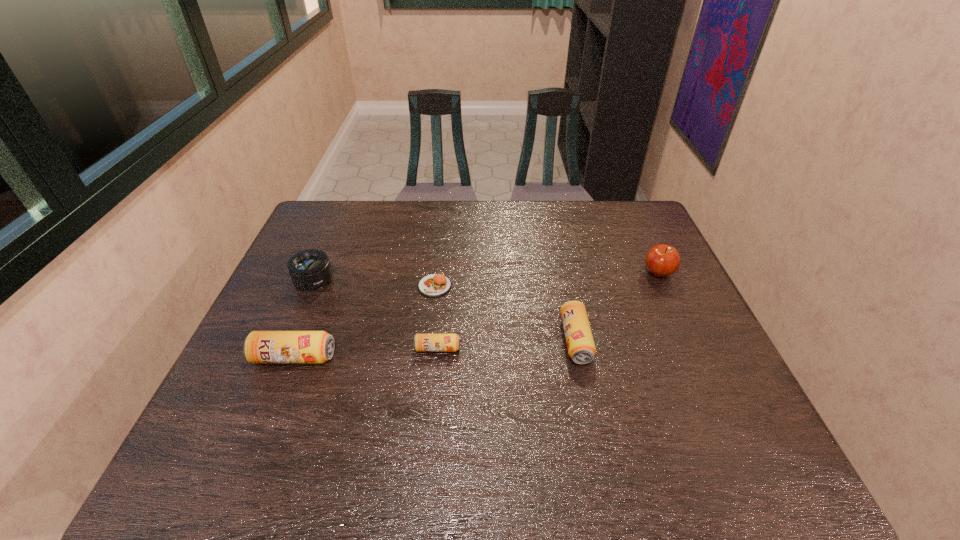
Please point a spot on the right to add another beer can. Please provide its 2D coordinates. Your answer should be formatted as a tuple, i.e. [(x, y)], where the tuple contains the x and y coordinates of a point satisfying the conditions above.

[(708, 332)]